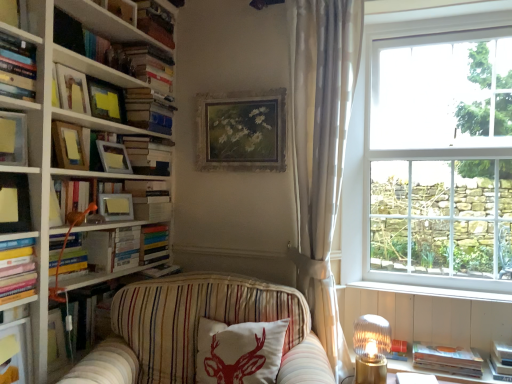
This screenshot has height=384, width=512. Identify the location of vacant region above white wood at lower right (from a real-world perspective). (415, 287).